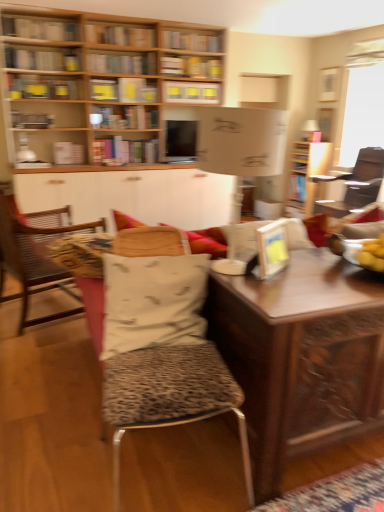
In order to face matte yellow book at upper left, placed as the seventh book when sorted from top to bottom, should I rotate leftwards or rightwards?

Rotate left and turn 18.563 degrees.

Describe the element at coordinates (191, 41) in the screenshot. I see `hardcover book at upper center, the 1th book positioned from the top` at that location.

Image resolution: width=384 pixels, height=512 pixels. What do you see at coordinates (153, 302) in the screenshot?
I see `white fabric pillow at center` at bounding box center [153, 302].

Where is `leopard print cushion at left`? leopard print cushion at left is located at coordinates (34, 260).

Measure the distance between point [5,221] and camera.

They are 2.97 meters apart.

At what (x,y) coordinates should I click in order to perform the action: click on hardcover book at upper center, the 3th book viewed from the top. Please return your answer as a coordinate pair (x, y). The height and width of the screenshot is (512, 384). Looking at the image, I should click on (122, 63).

Does hardcover book at upper left, which ranks as the first book in bottom-to-top order, lie in front of yellow paper at upper center, the fourth book from the bottom?

No, it is not.

Who is smaller, hardcover book at upper left, which ranks as the first book in bottom-to-top order, or yellow paper at upper center, the fourth book from the bottom?

With smaller size is yellow paper at upper center, the fourth book from the bottom.

Which is closer to the camera, (63, 153) or (91, 89)?

The point (63, 153) is closer.

Is leopard print cushion at left not within yellow paper at upper center, the sixth book viewed from the top?

leopard print cushion at left lies outside yellow paper at upper center, the sixth book viewed from the top,'s area.

Which is nearer, (56, 267) or (109, 84)?

The point (56, 267) is in front.

Measure the distance between leopard print cushion at left and yellow paper at upper center, the sixth book viewed from the top.

leopard print cushion at left and yellow paper at upper center, the sixth book viewed from the top, are 8.67 feet apart.

Between leopard print cushion at left and yellow paper at upper center, the fourth book from the bottom, which one is positioned behind?

yellow paper at upper center, the fourth book from the bottom, is further away from the camera.

You are a GUI agent. You are given a task and a screenshot of the screen. Output one action in this format:
    pyautogui.click(x=<x>, y=<y>)
    Task: Click on the book that is the 1st object to the right of the wooden bookcase at upper left, starting at the anchor
    The image size is (384, 512).
    Given the screenshot: What is the action you would take?
    pyautogui.click(x=191, y=92)

Is wooden bookcase at upper left not near matte white book at upper center, the fifth book positioned from the top?

They are positioned close to each other.

Looking at this image, considering the sizes of objects wooden bookcase at upper left and matte white book at upper center, the fifth book positioned from the top, in the image provided, who is thinner, wooden bookcase at upper left or matte white book at upper center, the fifth book positioned from the top,?

matte white book at upper center, the fifth book positioned from the top.

Between wooden bookcase at upper left and metallic silver bookshelf at upper left, acting as the second book starting from the bottom, which one is positioned in front?

wooden bookcase at upper left is closer to the camera.

Is wooden bookcase at upper left oriented towards metallic silver bookshelf at upper left, acting as the second book starting from the bottom?

Yes, wooden bookcase at upper left is facing metallic silver bookshelf at upper left, acting as the second book starting from the bottom.

Is wooden bookcase at upper left smaller than metallic silver bookshelf at upper left, acting as the second book starting from the bottom?

Incorrect, wooden bookcase at upper left is not smaller in size than metallic silver bookshelf at upper left, acting as the second book starting from the bottom.

From the picture: Visually, is wooden bookcase at upper left positioned to the left or to the right of metallic silver bookshelf at upper left, acting as the second book starting from the bottom?

wooden bookcase at upper left is positioned on metallic silver bookshelf at upper left, acting as the second book starting from the bottom,'s right side.

Is leopard print fabric stool at center oriented towards leopard print cushion at left?

No.

Considering the sizes of objects leopard print fabric stool at center and leopard print cushion at left in the image provided, who is shorter, leopard print fabric stool at center or leopard print cushion at left?

With less height is leopard print fabric stool at center.

Considering the positions of point (202, 346) and point (1, 211), is point (202, 346) closer or farther from the camera than point (1, 211)?

Point (202, 346) is positioned closer to the camera compared to point (1, 211).

Is leopard print fabric stool at center inside the boundaries of leopard print cushion at left, or outside?

leopard print fabric stool at center cannot be found inside leopard print cushion at left.

Could you tell me if matte white book at upper center, the fifth book when ordered from bottom to top, is turned towards wooden bookcase at upper left?

Yes, matte white book at upper center, the fifth book when ordered from bottom to top, is turned towards wooden bookcase at upper left.

Looking at the image, does matte white book at upper center, the fifth book positioned from the top, seem bigger or smaller compared to wooden bookcase at upper left?

Considering their sizes, matte white book at upper center, the fifth book positioned from the top, takes up less space than wooden bookcase at upper left.

Which is more to the right, wooden desk at center or hardcover book at upper center, the 1th book positioned from the top?

wooden desk at center.

Consider the image. How distant is wooden desk at center from hardcover book at upper center, placed as the 9th book when sorted from bottom to top?

17.60 feet.

Is hardcover book at upper center, the 1th book positioned from the top, at the back of wooden desk at center?

That's not correct — wooden desk at center is not looking away from hardcover book at upper center, the 1th book positioned from the top.

From the wooden desk at center, count the 1st book to the left and point to it. Please provide its 2D coordinates.

[(191, 41)]

From a real-world perspective, count 4th books upward from the hardcover book at upper left, which ranks as the first book in bottom-to-top order, and point to it. Please provide its 2D coordinates.

[(103, 90)]

At what (x,y) coordinates should I click in order to perform the action: click on chair lying in front of the yellow paper at upper center, the sixth book viewed from the top. Please return your answer as a coordinate pair (x, y). Looking at the image, I should click on (34, 260).

Considering their positions, is wooden desk at center positioned closer to matte yellow book at upper left, positioned as the sixth book in bottom-to-top order, than wooden bookshelf at upper center, the 8th book from the bottom?

Among the two, wooden bookshelf at upper center, the 8th book from the bottom, is located nearer to matte yellow book at upper left, positioned as the sixth book in bottom-to-top order.

Based on their spatial positions, is wooden bookshelf at upper center, the 8th book from the bottom, or leopard print cushion at left further from hardcover book at upper left, which ranks as the first book in bottom-to-top order?

leopard print cushion at left lies further to hardcover book at upper left, which ranks as the first book in bottom-to-top order, than the other object.

From the image, which object appears to be farther from yellow paper at upper center, the fourth book from the bottom, metallic silver bookshelf at upper left, acting as the second book starting from the bottom, or wooden desk at center?

wooden desk at center is further to yellow paper at upper center, the fourth book from the bottom.

Which object lies nearer to the anchor point leopard print cushion at left, white fabric pillow at center or wooden desk at center?

white fabric pillow at center lies closer to leopard print cushion at left than the other object.

Which object lies nearer to the anchor point wooden bookshelf at upper center, marked as the 2th book in a top-to-bottom arrangement, hardcover book at upper center, the seventh book from the bottom, or matte yellow book at upper left, positioned as the sixth book in bottom-to-top order?

Based on the image, hardcover book at upper center, the seventh book from the bottom, appears to be nearer to wooden bookshelf at upper center, marked as the 2th book in a top-to-bottom arrangement.

From the image, which object appears to be nearer to hardcover book at upper left, which ranks as the first book in bottom-to-top order, wooden table at center or leopard print cushion at left?

Based on the image, leopard print cushion at left appears to be nearer to hardcover book at upper left, which ranks as the first book in bottom-to-top order.

When comparing their distances from wooden table at center, does matte yellow book at upper left, the third book from the bottom, or wooden bookshelf at upper center, marked as the 2th book in a top-to-bottom arrangement, seem further?

wooden bookshelf at upper center, marked as the 2th book in a top-to-bottom arrangement, is positioned further to the anchor wooden table at center.

Estimate the real-world distances between objects in this image. Which object is further from wooden bookcase at upper left, wooden desk at center or matte white book at upper center, the fifth book when ordered from bottom to top?

The object further to wooden bookcase at upper left is wooden desk at center.

Image resolution: width=384 pixels, height=512 pixels. What are the coordinates of `bookcase positioned between wooden table at center and hardcover book at upper center, the 1th book positioned from the top, from near to far` in the screenshot? It's located at (88, 80).

At what (x,y) coordinates should I click in order to perform the action: click on bookcase situated between yellow paper at upper center, the fourth book from the bottom, and hardcover book at upper center, the 1th book positioned from the top, from left to right. Please return your answer as a coordinate pair (x, y). The image size is (384, 512). Looking at the image, I should click on (88, 80).

The image size is (384, 512). Identify the location of bookcase positioned between leopard print fabric stool at center and matte yellow book at upper left, the 4th book when ordered from top to bottom, from near to far. (88, 80).

Locate an element on the screen. The image size is (384, 512). chair positioned between wooden table at center and matte white book at upper center, the fifth book positioned from the top, from near to far is located at coordinates (34, 260).